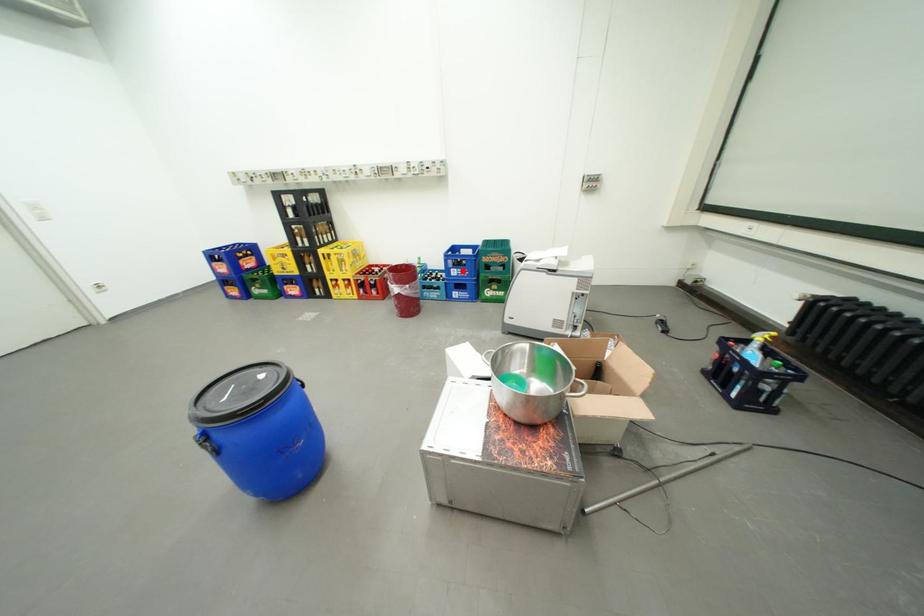
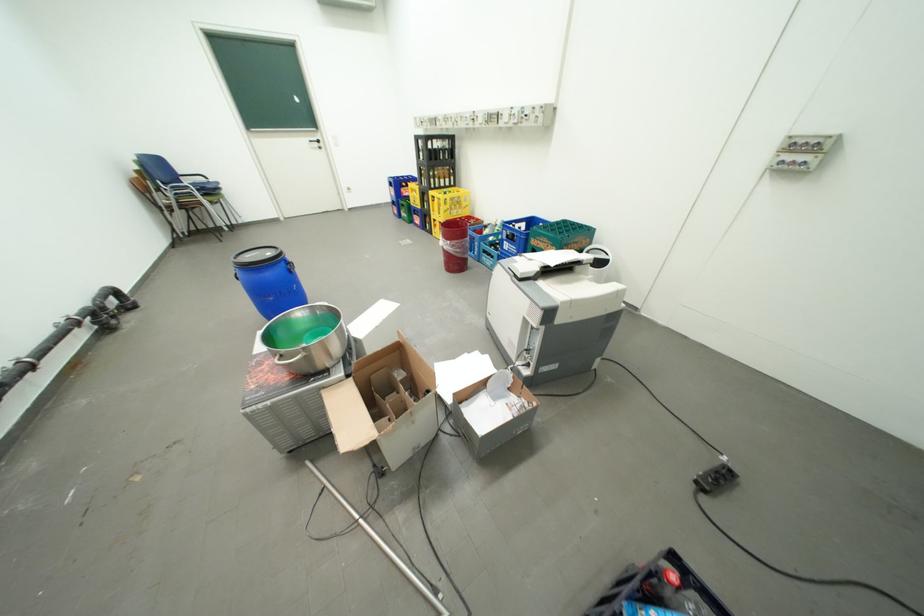
The point at the highlighted location is marked in the first image. Where is the corresponding point in the second image?

(516, 244)